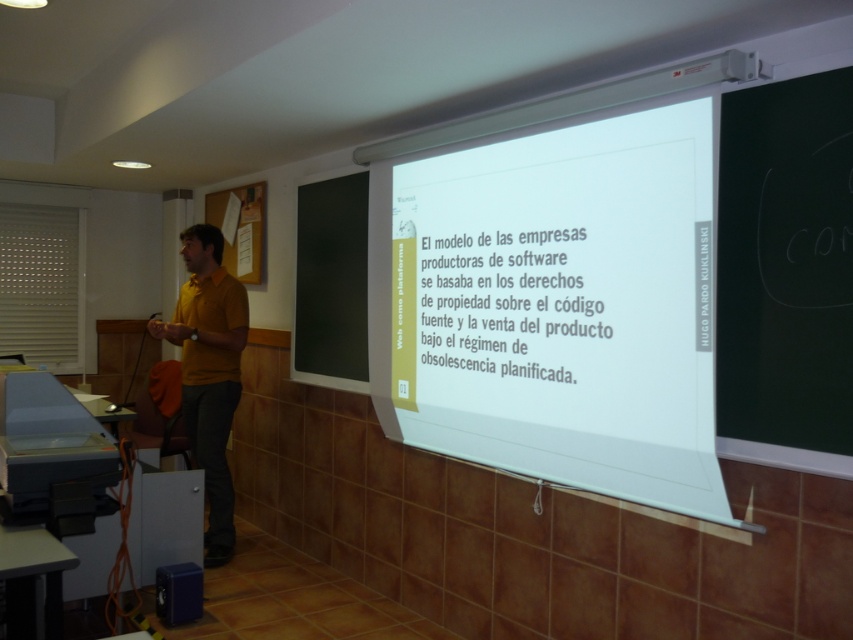
Question: Is white matte projection screen at center thinner than yellow matte shirt at left?

Choices:
 (A) yes
 (B) no

Answer: (B)

Question: Is white paper at center further to the viewer compared to yellow matte shirt at left?

Choices:
 (A) yes
 (B) no

Answer: (B)

Question: Which object appears closest to the camera in this image?

Choices:
 (A) white paper at center
 (B) black chalkboard at right
 (C) white matte projection screen at center
 (D) yellow matte shirt at left

Answer: (B)

Question: Which of the following is the farthest from the observer?

Choices:
 (A) (532, 442)
 (B) (523, 259)
 (C) (173, 330)

Answer: (C)

Question: Estimate the real-world distances between objects in this image. Which object is farther from the black chalkboard at right?

Choices:
 (A) yellow matte shirt at left
 (B) white matte projection screen at center

Answer: (A)

Question: Can you confirm if white matte projection screen at center is smaller than black chalkboard at right?

Choices:
 (A) no
 (B) yes

Answer: (A)